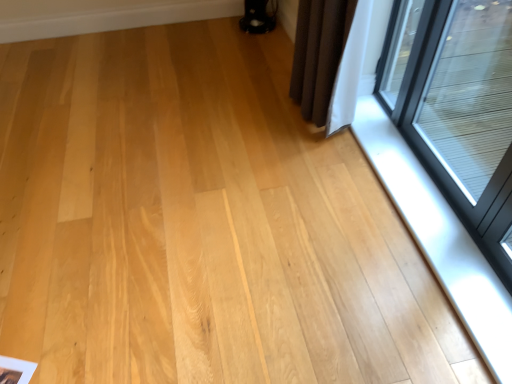
Where is `satin silver window sill at lower right`? satin silver window sill at lower right is located at coordinates (440, 237).

The image size is (512, 384). What do you see at coordinates (440, 237) in the screenshot?
I see `satin silver window sill at lower right` at bounding box center [440, 237].

What is the approximate width of satin silver window sill at lower right?

9.46 inches.

Describe the element at coordinates (459, 109) in the screenshot. The width and height of the screenshot is (512, 384). I see `transparent glass window at upper right` at that location.

At what (x,y) coordinates should I click in order to perform the action: click on transparent glass window at upper right. Please return your answer as a coordinate pair (x, y). The image size is (512, 384). Looking at the image, I should click on (459, 109).

Find the location of a particular element. satin silver window sill at lower right is located at coordinates (440, 237).

Considering the relative positions of satin silver window sill at lower right and transparent glass window at upper right in the image provided, is satin silver window sill at lower right to the left or to the right of transparent glass window at upper right?

From the image, it's evident that satin silver window sill at lower right is to the left of transparent glass window at upper right.

Does satin silver window sill at lower right come behind transparent glass window at upper right?

That is True.

Does point (355, 129) appear closer or farther from the camera than point (460, 131)?

Clearly, point (355, 129) is more distant from the camera than point (460, 131).

From the image's perspective, would you say satin silver window sill at lower right is positioned over transparent glass window at upper right?

No.

From a real-world perspective, which object rests below the other?

satin silver window sill at lower right, from a real-world perspective.

Between satin silver window sill at lower right and transparent glass window at upper right, which one has smaller width?

transparent glass window at upper right is thinner.

Between satin silver window sill at lower right and transparent glass window at upper right, which one has less height?

satin silver window sill at lower right is shorter.

Which of these two, satin silver window sill at lower right or transparent glass window at upper right, is bigger?

Bigger between the two is transparent glass window at upper right.

Is transparent glass window at upper right located within satin silver window sill at lower right?

Actually, transparent glass window at upper right is outside satin silver window sill at lower right.

Would you consider satin silver window sill at lower right to be distant from transparent glass window at upper right?

No.

Is transparent glass window at upper right at the back of satin silver window sill at lower right?

That's not correct — satin silver window sill at lower right is not looking away from transparent glass window at upper right.

How different are the orientations of satin silver window sill at lower right and transparent glass window at upper right in degrees?

The angular difference between satin silver window sill at lower right and transparent glass window at upper right is 1.58 degrees.

Identify the location of window lying in front of the satin silver window sill at lower right. The width and height of the screenshot is (512, 384). (459, 109).

Can you confirm if transparent glass window at upper right is positioned to the left of satin silver window sill at lower right?

No, transparent glass window at upper right is not to the left of satin silver window sill at lower right.

In the scene shown: Between transparent glass window at upper right and satin silver window sill at lower right, which one is positioned behind?

satin silver window sill at lower right is further from the camera.

Which point is more forward, (418, 108) or (400, 185)?

The point (400, 185) is in front.

From the image's perspective, relative to satin silver window sill at lower right, is transparent glass window at upper right above or below?

transparent glass window at upper right is situated higher than satin silver window sill at lower right in the image.

From a real-world perspective, is transparent glass window at upper right physically located above or below satin silver window sill at lower right?

In terms of real-world spatial position, transparent glass window at upper right is above satin silver window sill at lower right.

Consider the image. Is transparent glass window at upper right wider or thinner than satin silver window sill at lower right?

transparent glass window at upper right is thinner than satin silver window sill at lower right.

Considering the sizes of transparent glass window at upper right and satin silver window sill at lower right in the image, is transparent glass window at upper right taller or shorter than satin silver window sill at lower right?

Clearly, transparent glass window at upper right is taller compared to satin silver window sill at lower right.

Who is smaller, transparent glass window at upper right or satin silver window sill at lower right?

With smaller size is satin silver window sill at lower right.

Is transparent glass window at upper right surrounding satin silver window sill at lower right?

That's incorrect, satin silver window sill at lower right is not inside transparent glass window at upper right.

Is transparent glass window at upper right beside satin silver window sill at lower right?

No, transparent glass window at upper right is not in contact with satin silver window sill at lower right.

Is transparent glass window at upper right positioned with its back to satin silver window sill at lower right?

transparent glass window at upper right does not have its back to satin silver window sill at lower right.

Can you tell me how much transparent glass window at upper right and satin silver window sill at lower right differ in facing direction?

transparent glass window at upper right and satin silver window sill at lower right are facing 1.58 degrees away from each other.

Identify the location of window sill on the left side of transparent glass window at upper right. (440, 237).

In order to click on window positioned vertically above the satin silver window sill at lower right (from a real-world perspective) in this screenshot , I will do `click(459, 109)`.

Where is `window sill that is below the transparent glass window at upper right (from the image's perspective)`? The height and width of the screenshot is (384, 512). window sill that is below the transparent glass window at upper right (from the image's perspective) is located at coordinates (440, 237).